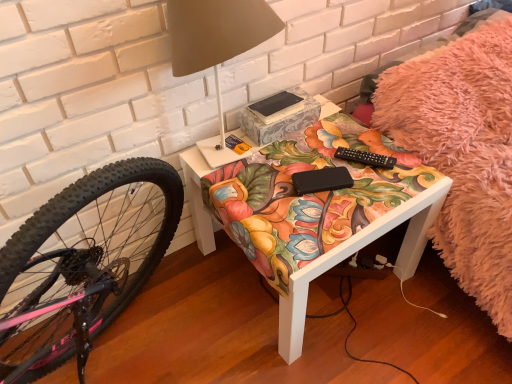
This screenshot has height=384, width=512. What are the coordinates of `free point above matte floral-patterned table at center (from a real-world perspective)` in the screenshot? It's located at (308, 168).